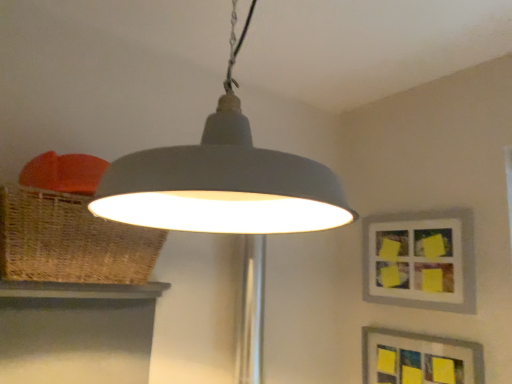
Question: Does woven brown basket at left have a lesser width compared to matte gray lampshade at center?

Choices:
 (A) no
 (B) yes

Answer: (B)

Question: Is woven brown basket at left positioned before matte gray lampshade at center?

Choices:
 (A) no
 (B) yes

Answer: (A)

Question: Would you consider woven brown basket at left to be distant from matte gray lampshade at center?

Choices:
 (A) yes
 (B) no

Answer: (B)

Question: From the image's perspective, is woven brown basket at left on matte gray lampshade at center?

Choices:
 (A) no
 (B) yes

Answer: (A)

Question: Does woven brown basket at left appear on the right side of matte gray lampshade at center?

Choices:
 (A) no
 (B) yes

Answer: (A)

Question: From a real-world perspective, is woven brown basket at left on matte gray lampshade at center?

Choices:
 (A) no
 (B) yes

Answer: (A)

Question: Is matte gray lampshade at center placed right next to woven brown basket at left?

Choices:
 (A) no
 (B) yes

Answer: (A)

Question: Can you confirm if matte gray lampshade at center is positioned to the right of woven brown basket at left?

Choices:
 (A) no
 (B) yes

Answer: (B)

Question: From the image's perspective, is matte gray lampshade at center above woven brown basket at left?

Choices:
 (A) yes
 (B) no

Answer: (A)

Question: Does matte gray lampshade at center have a greater height compared to woven brown basket at left?

Choices:
 (A) no
 (B) yes

Answer: (B)

Question: Can you confirm if matte gray lampshade at center is wider than woven brown basket at left?

Choices:
 (A) no
 (B) yes

Answer: (B)

Question: Does matte gray lampshade at center come in front of woven brown basket at left?

Choices:
 (A) no
 (B) yes

Answer: (B)

Question: From a real-world perspective, is matte gray picture frame at upper right, the 1th picture frame viewed from the top, physically below matte gray picture frame at lower right, which is counted as the second picture frame, starting from the top?

Choices:
 (A) no
 (B) yes

Answer: (A)